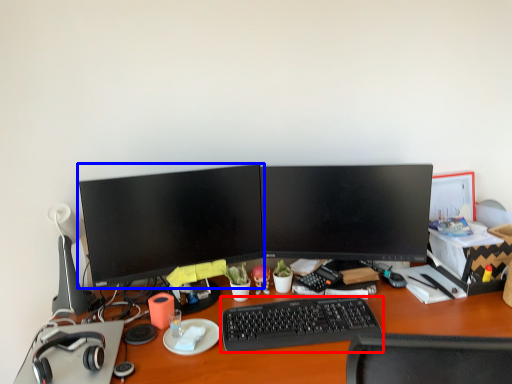
Question: Which point is further to the camera, computer keyboard (highlighted by a red box) or computer monitor (highlighted by a blue box)?

Choices:
 (A) computer keyboard
 (B) computer monitor

Answer: (B)